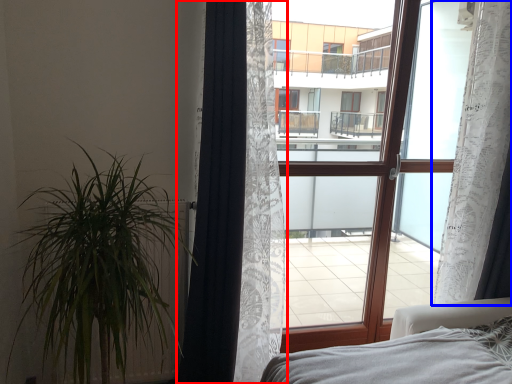
Question: Which object appears closest to the camera in this image, curtain (highlighted by a red box) or curtain (highlighted by a blue box)?

Choices:
 (A) curtain
 (B) curtain

Answer: (A)